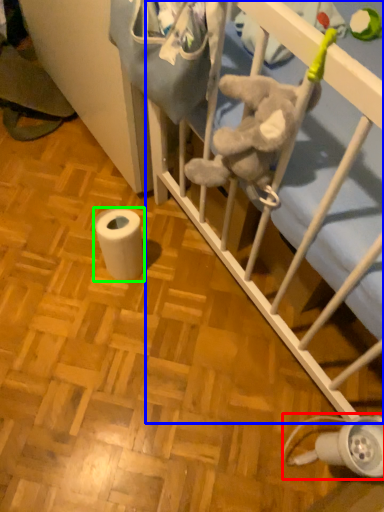
Question: Which object is the farthest from lamp (highlighted by a red box)? Choose among these: infant bed (highlighted by a blue box) or toilet paper (highlighted by a green box).

Choices:
 (A) infant bed
 (B) toilet paper

Answer: (B)